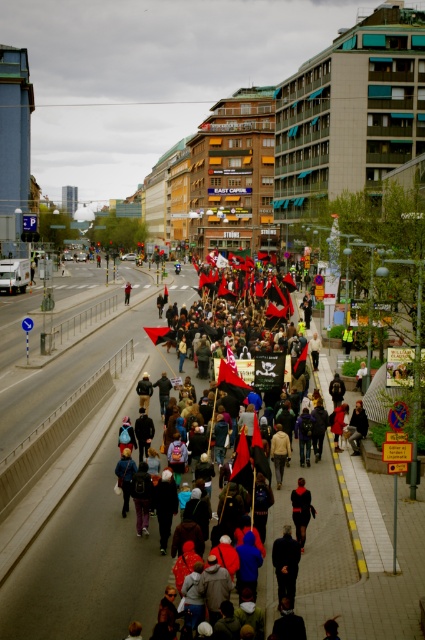
Question: Does dark red fabric flag at center appear on the left side of dark blue jacket at center?

Choices:
 (A) yes
 (B) no

Answer: (B)

Question: Is dark red fabric flag at center to the left of dark blue jacket at center from the viewer's perspective?

Choices:
 (A) no
 (B) yes

Answer: (A)

Question: Which object is closer to the camera taking this photo?

Choices:
 (A) dark blue jacket at center
 (B) dark red fabric flag at center

Answer: (B)

Question: Is dark red fabric flag at center to the right of dark blue jacket at center from the viewer's perspective?

Choices:
 (A) no
 (B) yes

Answer: (B)

Question: Among these objects, which one is farthest from the camera?

Choices:
 (A) dark red fabric flag at center
 (B) dark blue jacket at center

Answer: (B)

Question: Which point appears closest to the camera in this image?

Choices:
 (A) (289, 364)
 (B) (127, 289)

Answer: (A)